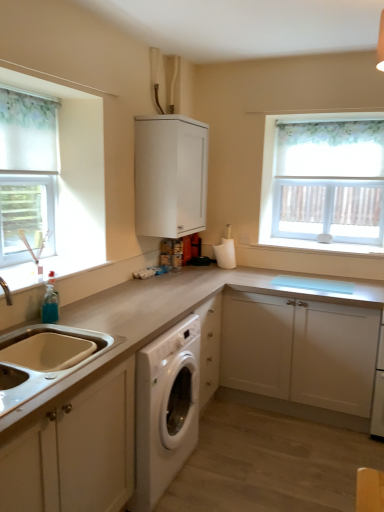
Question: Should I look upward or downward to see white matte sink at lower left, which is the second cabinetry from top to bottom?

Choices:
 (A) down
 (B) up

Answer: (A)

Question: From the image's perspective, is white matte toilet paper holder at center located beneath white matte sink at lower left, acting as the 3th cabinetry starting from the back?

Choices:
 (A) no
 (B) yes

Answer: (A)

Question: Is white matte toilet paper holder at center positioned with its back to white matte sink at lower left, which is the second cabinetry from top to bottom?

Choices:
 (A) no
 (B) yes

Answer: (A)

Question: Does white matte toilet paper holder at center have a larger size compared to white matte sink at lower left, the 1th cabinetry positioned from the front?

Choices:
 (A) no
 (B) yes

Answer: (A)

Question: Is white matte toilet paper holder at center not close to white matte sink at lower left, which is the second cabinetry from top to bottom?

Choices:
 (A) yes
 (B) no

Answer: (A)

Question: Considering the relative positions of white matte toilet paper holder at center and white matte sink at lower left, the 1th cabinetry positioned from the front, in the image provided, is white matte toilet paper holder at center to the right of white matte sink at lower left, the 1th cabinetry positioned from the front, from the viewer's perspective?

Choices:
 (A) no
 (B) yes

Answer: (B)

Question: Considering the relative sizes of white matte toilet paper holder at center and white matte sink at lower left, acting as the 3th cabinetry starting from the back, in the image provided, is white matte toilet paper holder at center shorter than white matte sink at lower left, acting as the 3th cabinetry starting from the back,?

Choices:
 (A) yes
 (B) no

Answer: (B)

Question: Is white matte cabinet at center, arranged as the second cabinetry when viewed from the back, positioned beyond the bounds of white matte sink at lower left, acting as the 3th cabinetry starting from the back?

Choices:
 (A) yes
 (B) no

Answer: (A)

Question: Is white matte cabinet at center, arranged as the second cabinetry when viewed from the back, taller than white matte sink at lower left, which is the 1th cabinetry in left-to-right order?

Choices:
 (A) yes
 (B) no

Answer: (A)

Question: Could you tell me if white matte cabinet at center, arranged as the 3th cabinetry when viewed from the top, is facing white matte sink at lower left, which is the second cabinetry from top to bottom?

Choices:
 (A) no
 (B) yes

Answer: (B)

Question: From the image's perspective, is white matte cabinet at center, arranged as the second cabinetry when viewed from the back, located beneath white matte sink at lower left, the 1th cabinetry positioned from the front?

Choices:
 (A) no
 (B) yes

Answer: (B)

Question: From a real-world perspective, is white matte cabinet at center, which is the second cabinetry from front to back, over white matte sink at lower left, the 1th cabinetry positioned from the front?

Choices:
 (A) yes
 (B) no

Answer: (B)

Question: Is white matte sink at lower left, marked as the third cabinetry in a right-to-left arrangement, located within white matte cabinet at center, the 1th cabinetry ordered from the bottom?

Choices:
 (A) no
 (B) yes

Answer: (A)

Question: Is white matte toilet paper holder at center located outside white fabric curtain at left?

Choices:
 (A) yes
 (B) no

Answer: (A)